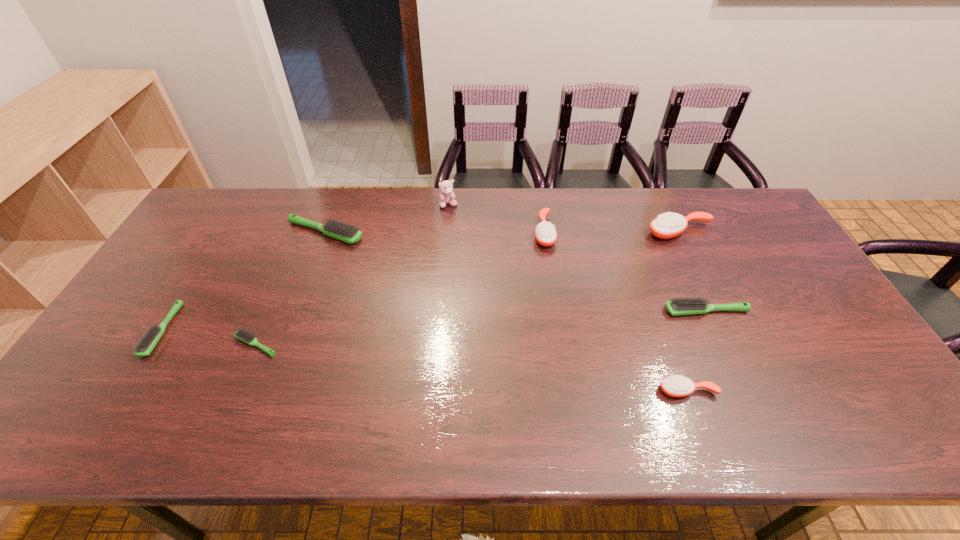
This screenshot has width=960, height=540. I want to click on the leftmost object, so click(144, 347).

What are the coordinates of `the sixth tallest hairbrush` in the screenshot? It's located at (144, 347).

Where is `the shortest object`? The width and height of the screenshot is (960, 540). the shortest object is located at coordinates (242, 334).

Locate an element on the screen. This screenshot has width=960, height=540. the shortest hairbrush is located at coordinates pyautogui.click(x=242, y=334).

The height and width of the screenshot is (540, 960). In order to click on vacant region located 0.400m at the face of the teddy bear in this screenshot , I will do `click(442, 296)`.

Image resolution: width=960 pixels, height=540 pixels. I want to click on vacant region located on the left of the biggest orange hairbrush, so click(x=607, y=232).

Where is `vacant space positioned 0.180m on the left of the fourth hairbrush from right to left`? The height and width of the screenshot is (540, 960). vacant space positioned 0.180m on the left of the fourth hairbrush from right to left is located at coordinates (478, 232).

Identify the location of vacant region located 0.070m on the right of the biggest light hairbrush. The width and height of the screenshot is (960, 540). point(386,233).

Identify the location of vacant space located on the left of the rightmost light hairbrush. (588, 311).

Where is `free spot located 0.100m on the left of the nearest orange hairbrush`? Image resolution: width=960 pixels, height=540 pixels. free spot located 0.100m on the left of the nearest orange hairbrush is located at coordinates (616, 390).